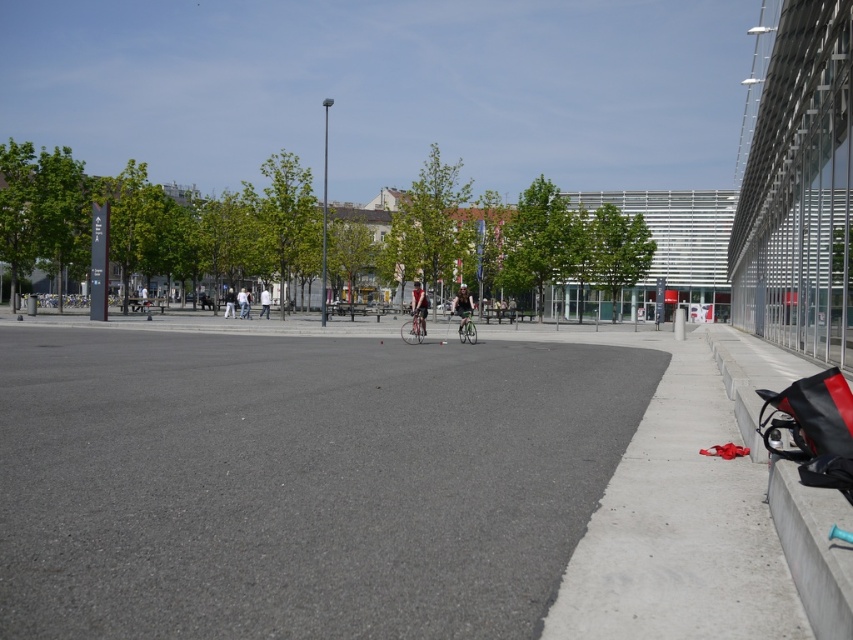
You are a delivery person who needs to park your matte black bicycle at center near the concrete ledge at right. Is there enough space to park the bicycle next to the ledge?

The concrete ledge at right is smaller than the matte black bicycle at center. Therefore, there should be enough space to park the matte black bicycle at center next to the concrete ledge at right since the ledge does not obstruct the area.